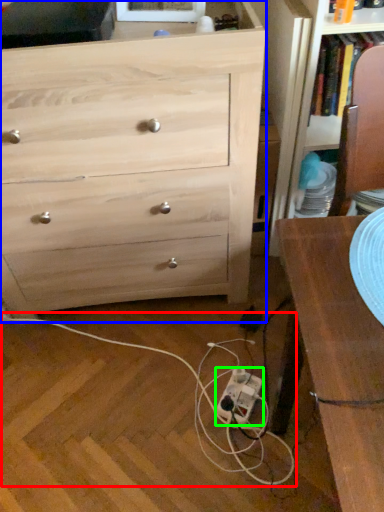
Question: Which is nearer to the string (highlighted by a red box)? chest of drawers (highlighted by a blue box) or extension cord (highlighted by a green box).

Choices:
 (A) chest of drawers
 (B) extension cord

Answer: (B)